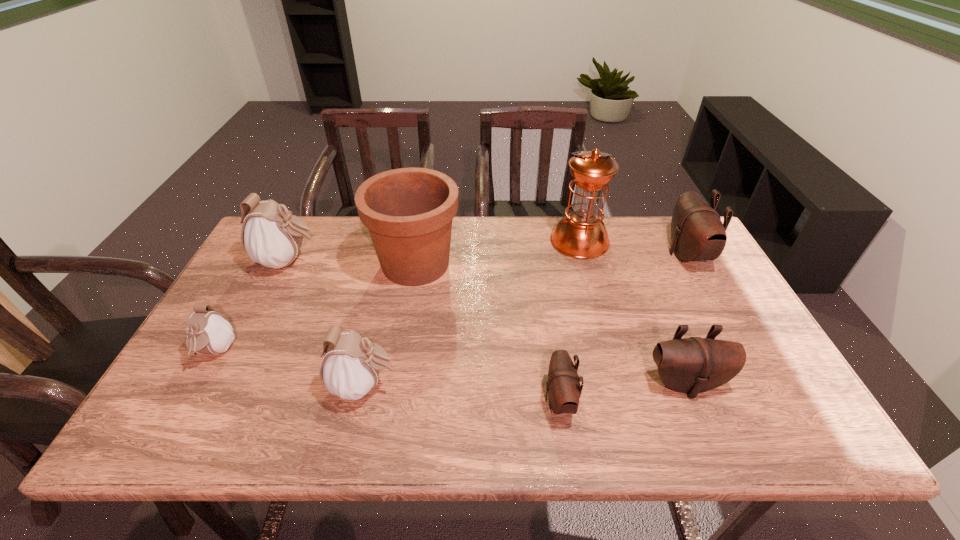
Where is `the tallest object`? Image resolution: width=960 pixels, height=540 pixels. the tallest object is located at coordinates (581, 234).

At what (x,y) coordinates should I click in order to perform the action: click on flowerpot. Please return your answer as a coordinate pair (x, y). Image resolution: width=960 pixels, height=540 pixels. Looking at the image, I should click on (408, 211).

The height and width of the screenshot is (540, 960). I want to click on the biggest white pouch, so click(x=272, y=237).

In order to click on the farthest brown pouch in this screenshot , I will do `click(697, 232)`.

Image resolution: width=960 pixels, height=540 pixels. Identify the location of the rightmost brown pouch. (697, 232).

Image resolution: width=960 pixels, height=540 pixels. What are the coordinates of `the second biggest white pouch` in the screenshot? It's located at (350, 368).

The image size is (960, 540). I want to click on the fourth pouch from right to left, so click(350, 368).

This screenshot has height=540, width=960. I want to click on the second pouch from right to left, so click(x=693, y=365).

You are a GUI agent. You are given a task and a screenshot of the screen. Output one action in this format:
    pyautogui.click(x=<x>, y=<y>)
    Task: Click on the second smallest brown pouch
    
    Given the screenshot: What is the action you would take?
    pyautogui.click(x=693, y=365)

Where is `the smallest white pouch`? The image size is (960, 540). the smallest white pouch is located at coordinates (208, 332).